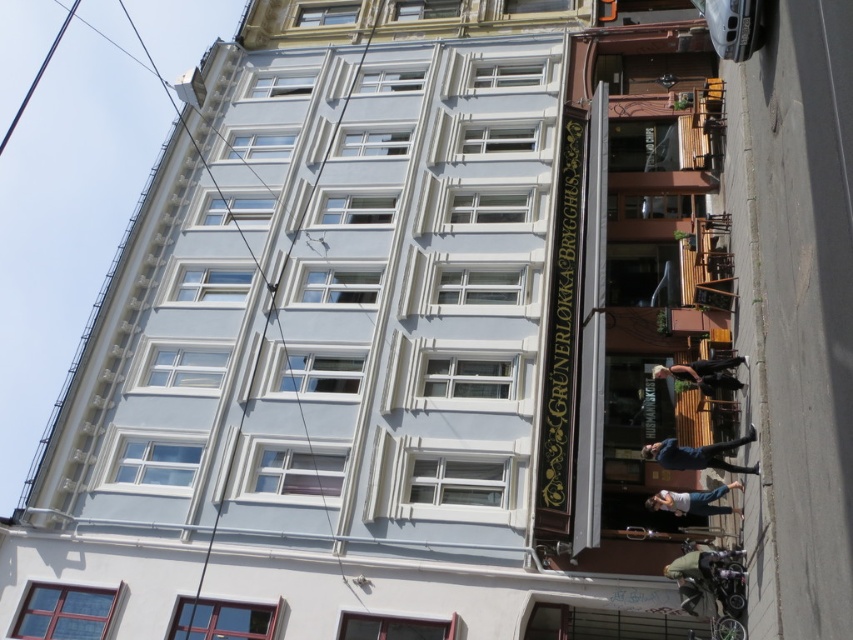
Question: Among these objects, which one is farthest from the camera?

Choices:
 (A) light blue jeans at lower center
 (B) green fabric jacket at lower right
 (C) dark blue jeans at center
 (D) blue denim jacket at lower center

Answer: (C)

Question: Can you confirm if blue denim jacket at lower center is positioned to the left of light blue jeans at lower center?

Choices:
 (A) yes
 (B) no

Answer: (B)

Question: Which object appears closest to the camera in this image?

Choices:
 (A) light blue jeans at lower center
 (B) blue denim jacket at lower center

Answer: (B)

Question: From the image, what is the correct spatial relationship of blue denim jacket at lower center in relation to dark blue jeans at center?

Choices:
 (A) left
 (B) right

Answer: (A)

Question: Based on their relative distances, which object is farther from the dark blue jeans at center?

Choices:
 (A) blue denim jacket at lower center
 (B) light blue jeans at lower center
 (C) green fabric jacket at lower right

Answer: (C)

Question: Is green fabric jacket at lower right below blue denim jacket at lower center?

Choices:
 (A) yes
 (B) no

Answer: (A)